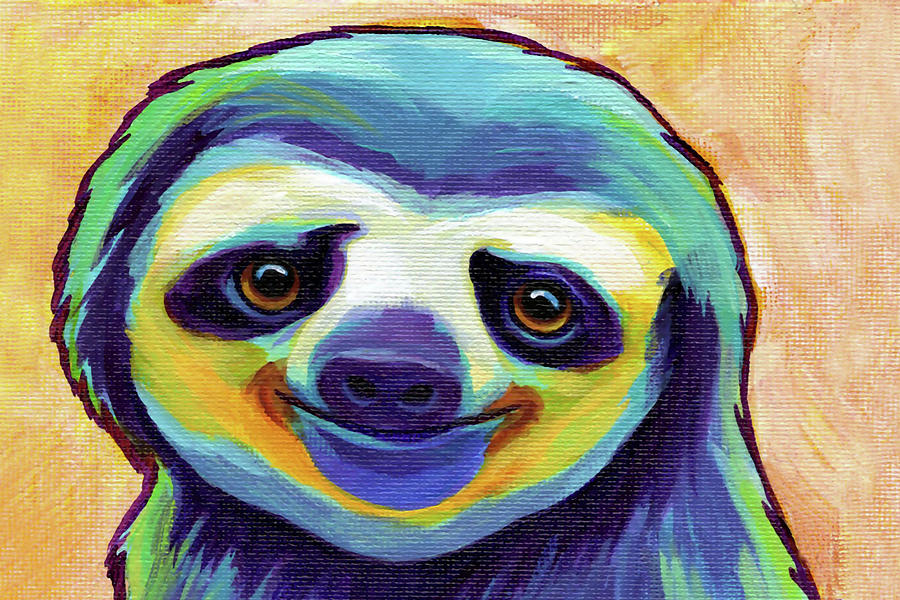
I want to click on brown trim, so click(x=731, y=222).